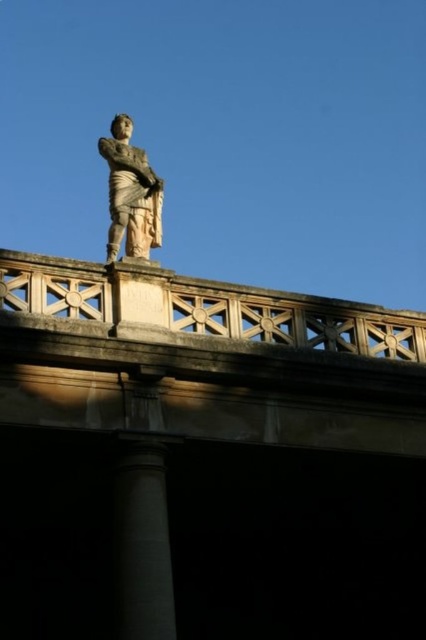
Is white stone bridge at upper center in front of stone statue at center?

Yes.

Find the location of a particular element. The width and height of the screenshot is (426, 640). white stone bridge at upper center is located at coordinates (206, 458).

Who is higher up, smooth gray column at center or stone statue at center?

stone statue at center is above.

Does smooth gray column at center appear on the right side of stone statue at center?

Correct, you'll find smooth gray column at center to the right of stone statue at center.

The height and width of the screenshot is (640, 426). What do you see at coordinates (143, 545) in the screenshot?
I see `smooth gray column at center` at bounding box center [143, 545].

Find the location of `smooth gray column at center`. smooth gray column at center is located at coordinates (143, 545).

Locate an element on the screen. The image size is (426, 640). white stone bridge at upper center is located at coordinates (206, 458).

Does white stone bridge at upper center have a lesser width compared to smooth gray column at center?

No, white stone bridge at upper center is not thinner than smooth gray column at center.

Identify the location of white stone bridge at upper center. (206, 458).